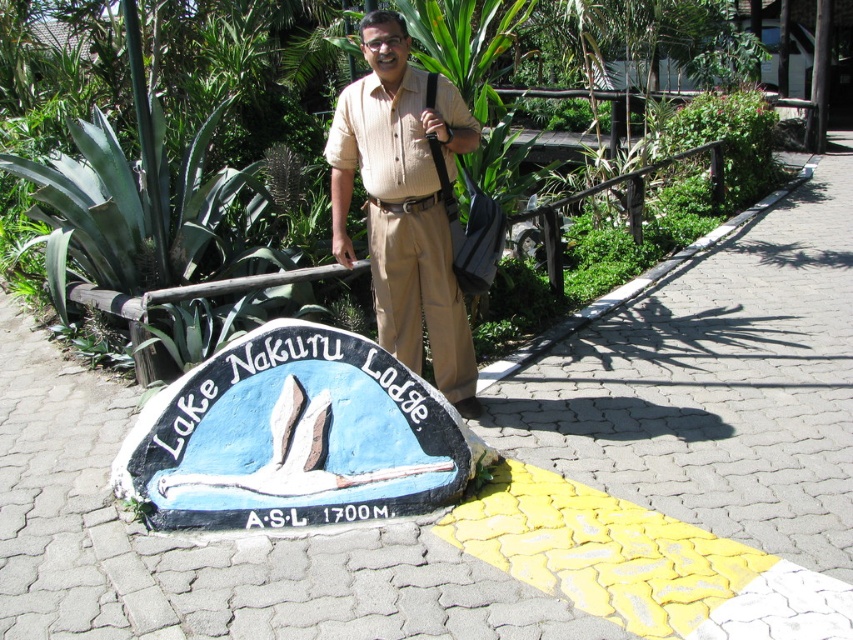
You are standing at the point marked as point (257, 342) in the image. You want to take a photo of the Lake Nakuru Lodge sign that is 10 feet tall. If your camera can capture objects up to 10 feet tall from a distance of 10 feet, can you capture the entire sign in one shot without moving?

The point (257, 342) and camera are 10.28 feet apart. Since the distance is slightly more than 10 feet, the camera might not capture the entire 10 feet tall sign in one shot without moving closer.

You are a photographer trying to capture the blue painted stone lake nakuru lodge sign at center and the beige striped shirt at center in a single frame. Based on their sizes, which object should you focus on to ensure both are clearly visible in the photo?

The blue painted stone lake nakuru lodge sign at center is wider than the beige striped shirt at center. To ensure both are clearly visible, focus on the sign first as it occupies more space in the frame.

You are a photographer taking a picture of the Lake Nakuru Lodge sign. You notice the beige striped shirt at center and the green leafy plant at center in the background. Which object should you adjust your camera angle to focus on if you want to highlight the one that is taller?

The beige striped shirt at center is taller than the green leafy plant at center, so you should focus on the beige striped shirt at center to highlight the taller object.